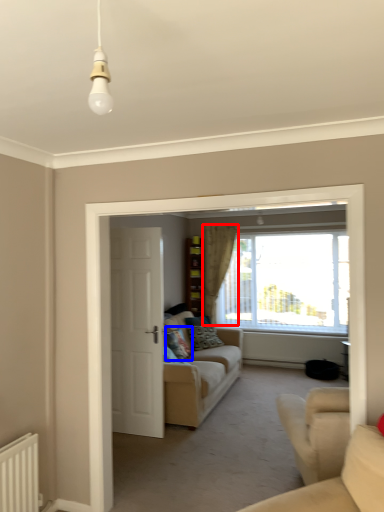
Question: Which point is further to the camera, curtain (highlighted by a red box) or pillow (highlighted by a blue box)?

Choices:
 (A) curtain
 (B) pillow

Answer: (A)